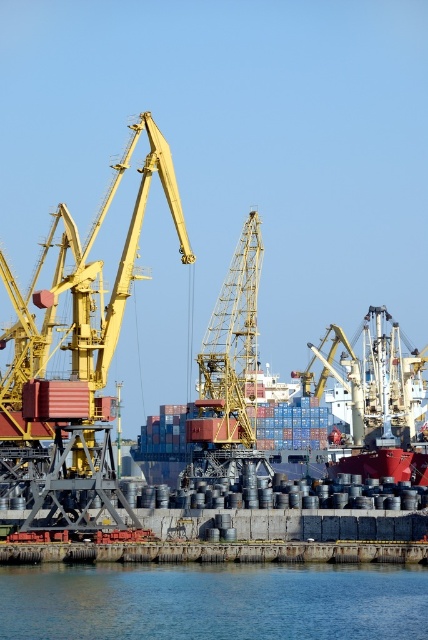
Question: Which object appears closest to the camera in this image?

Choices:
 (A) red matte container ship at center
 (B) yellow metallic crane at center

Answer: (A)

Question: Among these points, which one is farthest from the camera?

Choices:
 (A) (196, 358)
 (B) (416, 636)
 (C) (338, 465)

Answer: (C)

Question: Does blue liquid water at lower center have a lesser width compared to red matte container ship at center?

Choices:
 (A) no
 (B) yes

Answer: (B)

Question: Does blue liquid water at lower center have a lesser width compared to red matte container ship at center?

Choices:
 (A) yes
 (B) no

Answer: (A)

Question: Which of these objects is positioned farthest from the red matte container ship at center?

Choices:
 (A) blue liquid water at lower center
 (B) yellow metallic crane at center

Answer: (A)

Question: Does blue liquid water at lower center come behind yellow metallic crane at center?

Choices:
 (A) no
 (B) yes

Answer: (A)